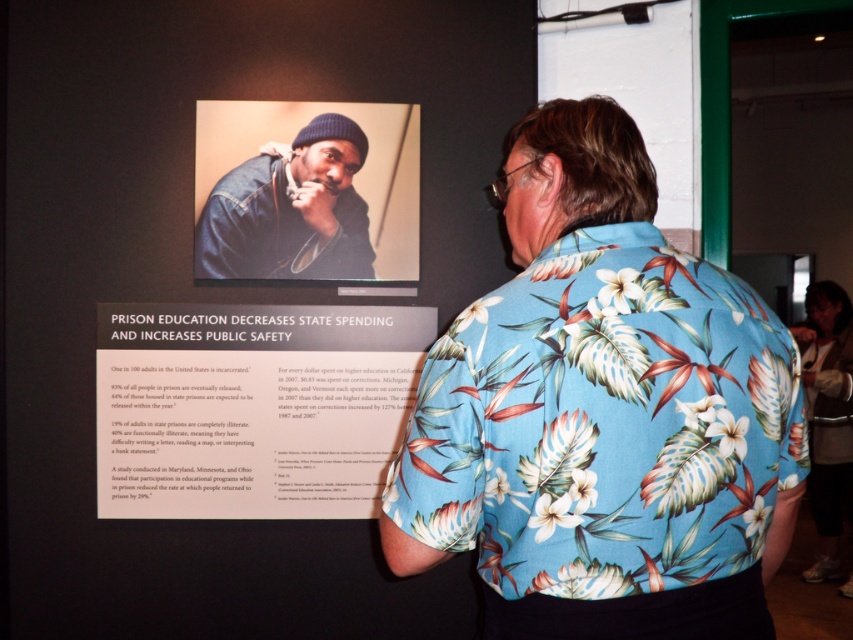
You are a photographer trying to capture a clear shot of both the blue floral print shirt at upper center and the floral print shirt at center. Since you can only focus on one at a time, which one should you choose to ensure the other is still in the frame?

The blue floral print shirt at upper center is positioned on the left side of the floral print shirt at center. Therefore, focusing on the floral print shirt at center would still keep the blue floral print shirt at upper center within the frame, as it is to the left of it.

You are an interior designer observing the scene. The client wants to hang a new picture frame that is the same size as the blue floral print shirt at upper center above the matte paper poster at center. Is this possible given their current positions?

The blue floral print shirt at upper center is already positioned above the matte paper poster at center. Since the new frame would be placed in the same location as the shirt, it cannot be hung above the poster without overlapping.

What is the relationship between the width of the blue floral print shirt at upper center and the floral print shirt at center?

The blue floral print shirt at upper center might be wider than the floral print shirt at center.